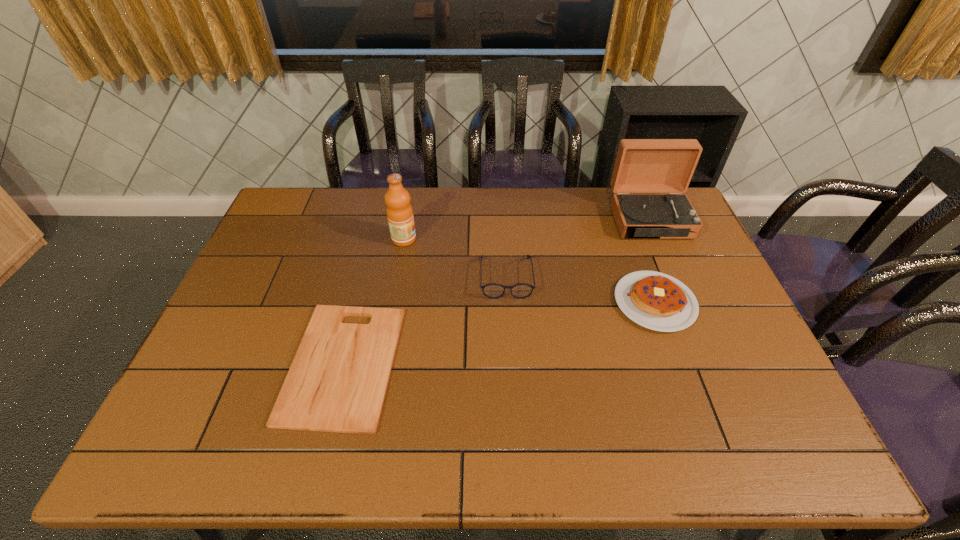
This screenshot has height=540, width=960. Find the location of `free space located on the left of the chopping board`. free space located on the left of the chopping board is located at coordinates (248, 364).

Locate an element on the screen. object at the far edge is located at coordinates (642, 165).

The image size is (960, 540). Find the location of `object that is positioned at the near edge`. object that is positioned at the near edge is located at coordinates (337, 382).

Find the location of `phonograph record at the right edge`. phonograph record at the right edge is located at coordinates (642, 165).

This screenshot has width=960, height=540. I want to click on pancake present at the right edge, so click(657, 301).

At what (x,y) coordinates should I click in order to perform the action: click on object present at the far right corner. Please return your answer as a coordinate pair (x, y). Looking at the image, I should click on (642, 165).

Identify the location of vacant space at the far edge of the desktop. (332, 217).

Where is `free space at the near edge of the desktop`? This screenshot has width=960, height=540. free space at the near edge of the desktop is located at coordinates (337, 458).

Locate an element on the screen. vacant space at the left edge is located at coordinates (185, 408).

In the image, there is a desktop. Where is `vacant region at the right edge`? The width and height of the screenshot is (960, 540). vacant region at the right edge is located at coordinates (687, 337).